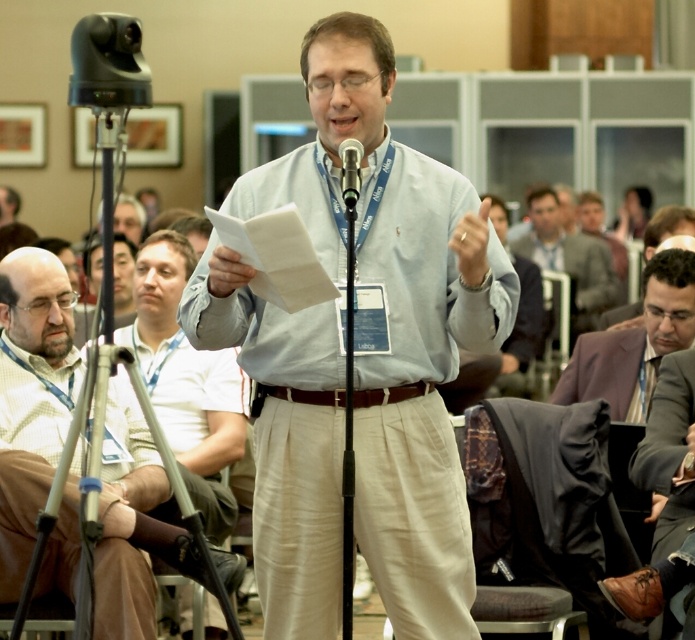
Question: Which object is farther from the camera taking this photo?

Choices:
 (A) light brown sweater at left
 (B) black metallic microphone at center
 (C) light brown suit at center
 (D) light blue shirt at center

Answer: (C)

Question: In this image, where is light brown sweater at left located relative to black metallic microphone at center?

Choices:
 (A) right
 (B) left

Answer: (B)

Question: Is gray fabric shirt at center further to the viewer compared to black metallic microphone at center?

Choices:
 (A) yes
 (B) no

Answer: (A)

Question: Can you confirm if light brown sweater at left is bigger than black metallic microphone at center?

Choices:
 (A) no
 (B) yes

Answer: (B)

Question: Which point appears farthest from the camera in this image?

Choices:
 (A) (673, 348)
 (B) (97, 596)
 (C) (573, 300)
 (D) (515, 253)

Answer: (D)

Question: Among these points, which one is farthest from the camera?

Choices:
 (A) (359, 513)
 (B) (496, 198)
 (C) (587, 321)
 (D) (8, 554)

Answer: (B)